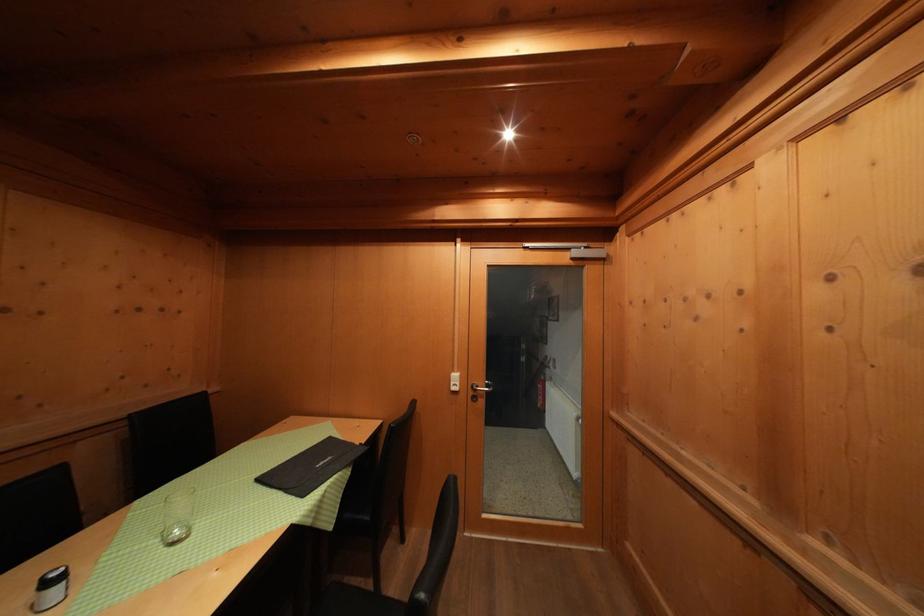
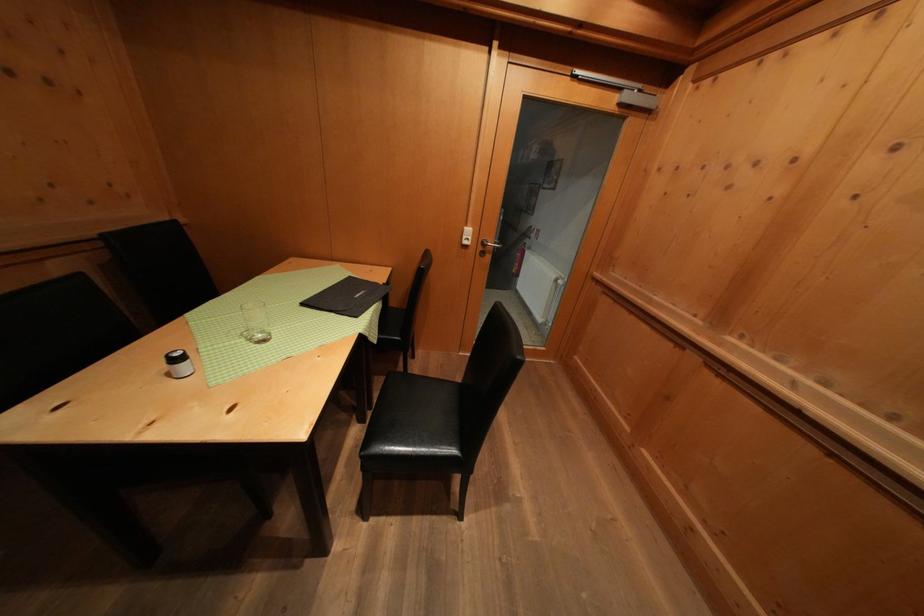
Where in the second image is the point corresponding to pixel 184 538 from the first image?

(264, 341)